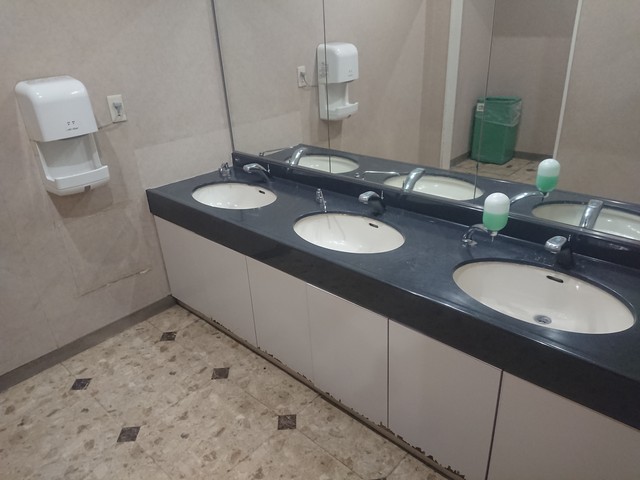
Identify the location of sink bowl. [x=342, y=236].